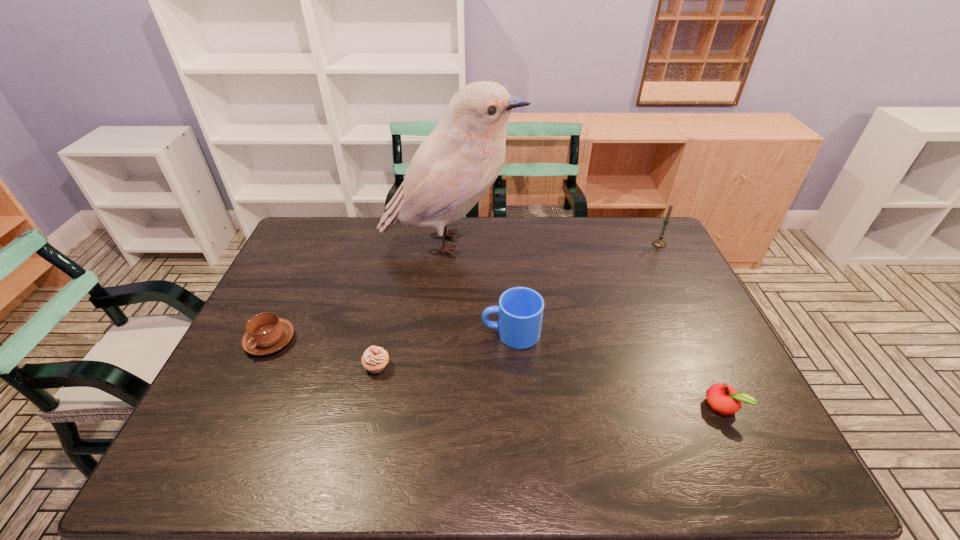
You are a GUI agent. You are given a task and a screenshot of the screen. Output one action in this format:
    pyautogui.click(x=<x>, y=<y>)
    Task: Click on the parakeet
    
    Given the screenshot: What is the action you would take?
    pyautogui.click(x=454, y=167)

The height and width of the screenshot is (540, 960). What are the coordinates of `candle` in the screenshot? It's located at click(x=660, y=243).

This screenshot has height=540, width=960. I want to click on the third tallest object, so click(520, 311).

At what (x,y) coordinates should I click in order to perform the action: click on the third shortest object. Please return your answer as a coordinate pair (x, y). The image size is (960, 540). Looking at the image, I should click on (374, 359).

In order to click on the leftmost object in this screenshot , I will do `click(266, 333)`.

The height and width of the screenshot is (540, 960). I want to click on apple, so click(724, 399).

Locate an element on the screen. The width and height of the screenshot is (960, 540). free space located 0.260m on the face of the tallest object is located at coordinates (595, 244).

The height and width of the screenshot is (540, 960). Identify the location of free location located on the left of the second tallest object. (598, 244).

In order to click on vacant region located on the side of the mug with the handle in this screenshot , I will do `click(348, 333)`.

Find the location of a particular element. The image size is (960, 540). vacant space located on the side of the mug with the handle is located at coordinates (464, 333).